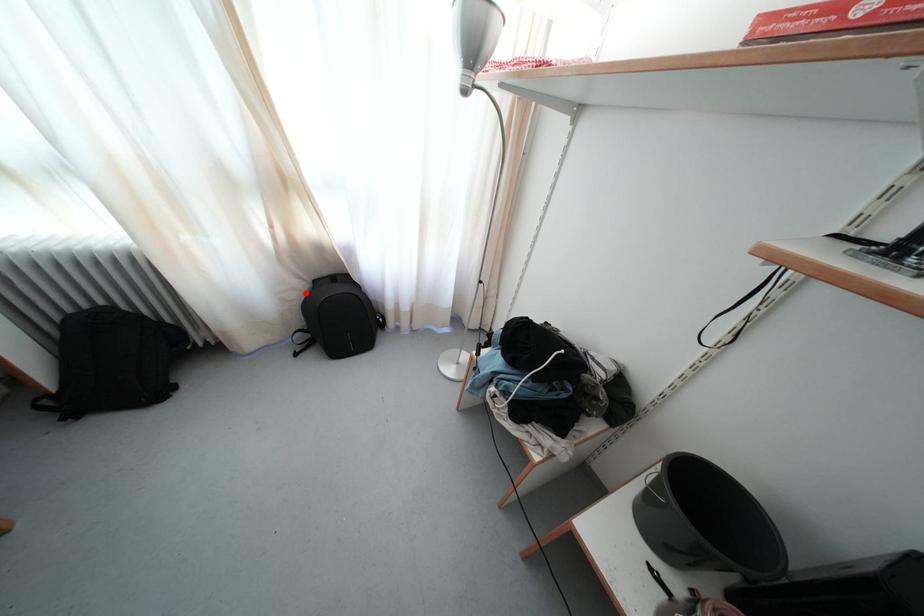
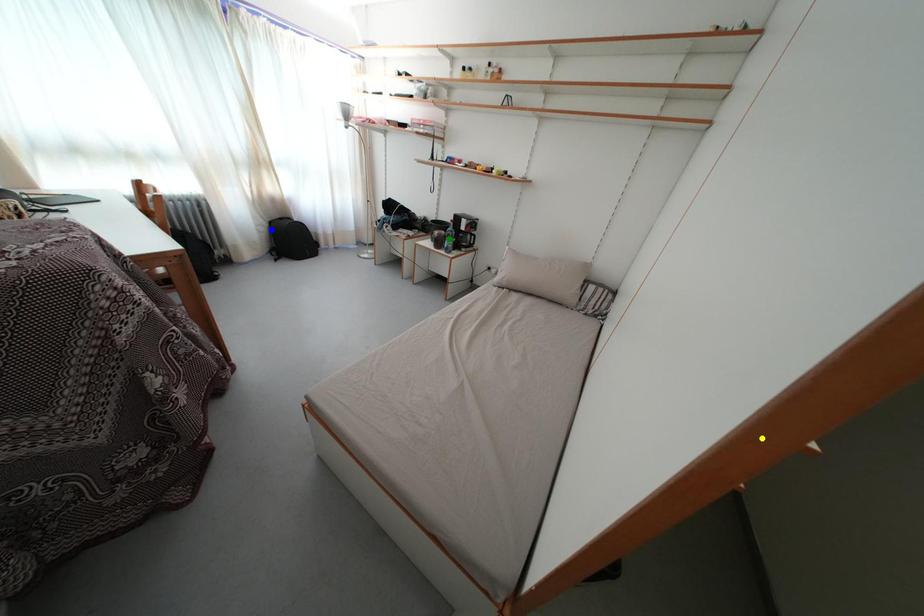
Question: I am providing you with two images of the same scene from different viewpoints. A red point is marked on the first image. You are given multiple points on the second image. Which mark in image 2 goes with the point in image 1?

Choices:
 (A) yellow point
 (B) green point
 (C) blue point

Answer: (C)